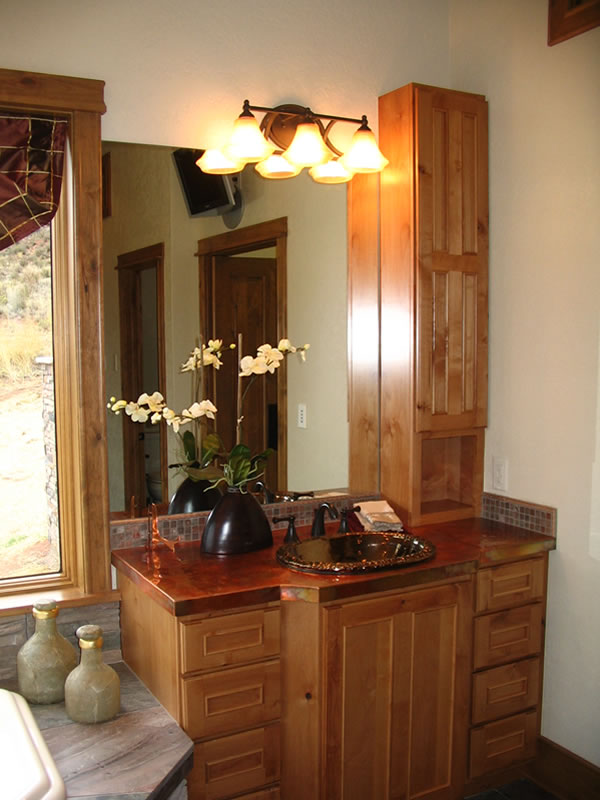
Locate an element on the screen. decoration 1 is located at coordinates (44, 669).